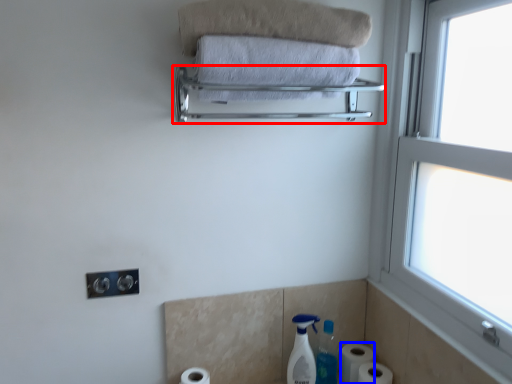
Question: Which point is closer to the camera, balustrade (highlighted by a red box) or toilet paper (highlighted by a blue box)?

Choices:
 (A) balustrade
 (B) toilet paper

Answer: (A)